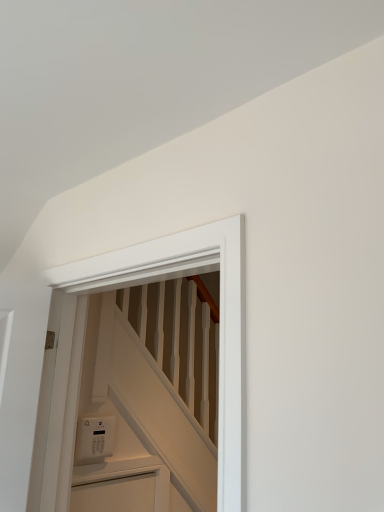
The width and height of the screenshot is (384, 512). Describe the element at coordinates (142, 283) in the screenshot. I see `white matte door at center` at that location.

What is the approximate height of white matte door at center?

92.25 centimeters.

You are a GUI agent. You are given a task and a screenshot of the screen. Output one action in this format:
    pyautogui.click(x=<x>, y=<y>)
    Task: Click on the white matte door at center
    
    Given the screenshot: What is the action you would take?
    pyautogui.click(x=142, y=283)

Locate an element on the screen. This screenshot has width=384, height=512. white matte door at center is located at coordinates (142, 283).